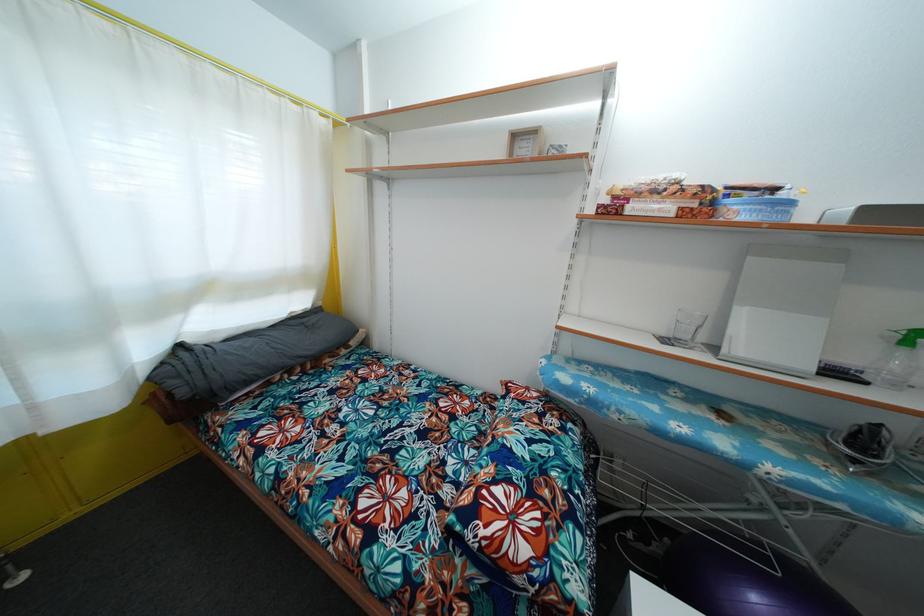
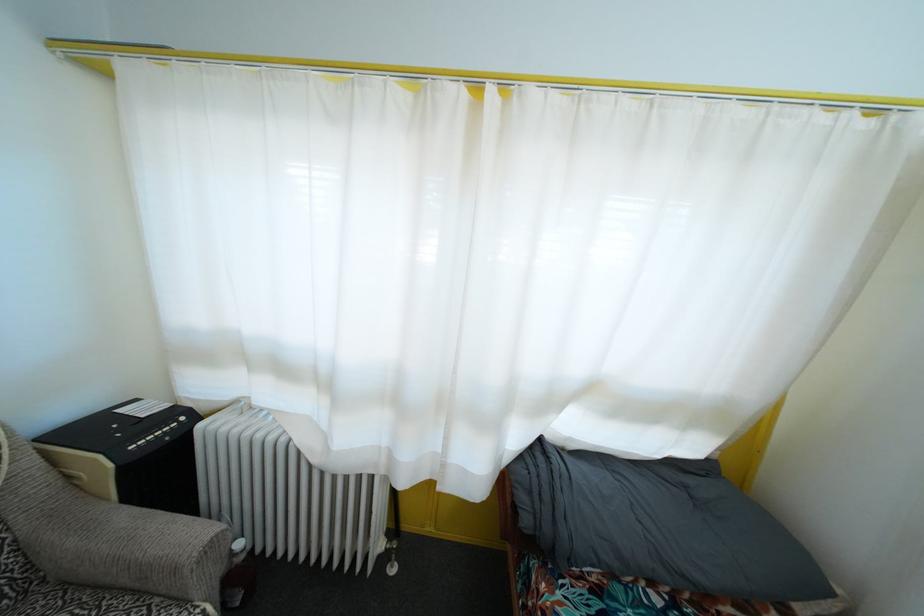
Find the pixel in the second image that matches [187,399] in the first image.

(529, 528)